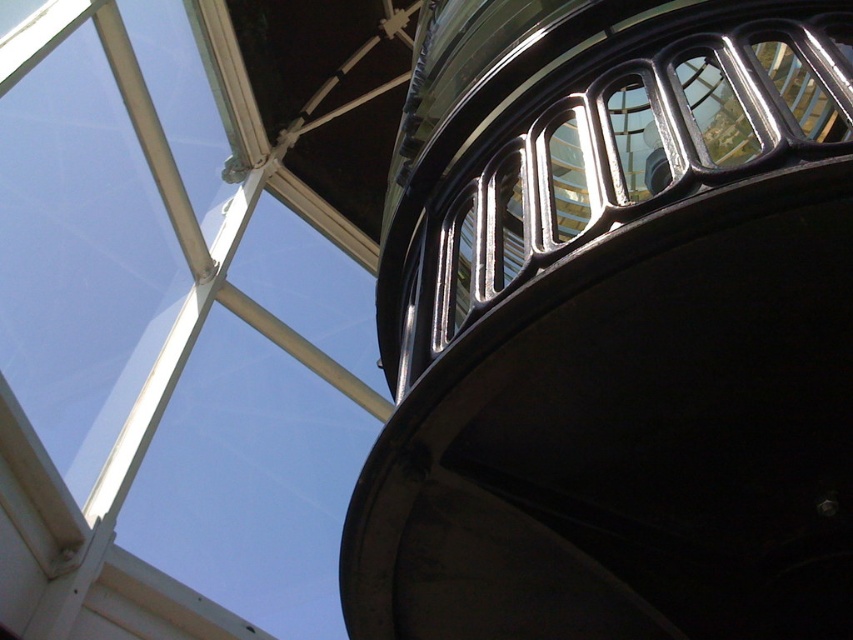
You are a maintenance worker inside the lighthouse and need to access the transparent glass window at upper left. Which side of the glossy metal tower at upper center should you go around to reach it?

The glossy metal tower at upper center is positioned on the right side of transparent glass window at upper left, so you should go around the left side of the glossy metal tower at upper center to reach the transparent glass window at upper left.

You are standing inside the lighthouse and see two points marked on the wall. The first point is at coordinates point (730, 180) and the second is at point (329, 220). From your perspective, which point is closer to you?

Point (730, 180) is in front of point (329, 220), so the first point is closer to you.